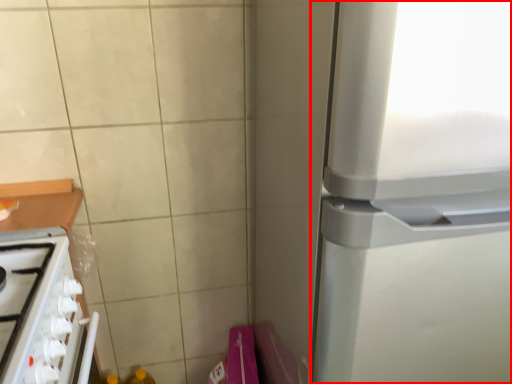
Question: From the image's perspective, what is the correct spatial positioning of refrigerator (annotated by the red box) in reference to home appliance?

Choices:
 (A) below
 (B) above

Answer: (B)